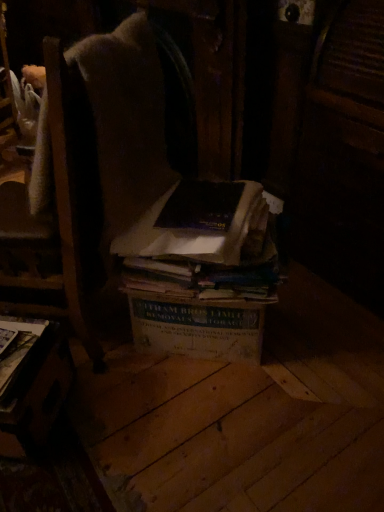
What do you see at coordinates (189, 234) in the screenshot? The width and height of the screenshot is (384, 512). I see `dark brown paper book at center, the second book when ordered from right to left` at bounding box center [189, 234].

Measure the distance between brown cardboard box at center, the 1th book viewed from the right, and camera.

brown cardboard box at center, the 1th book viewed from the right, is 1.16 meters away from camera.

The image size is (384, 512). I want to click on dark brown paper book at center, acting as the second book starting from the left, so click(189, 234).

Considering the sizes of dark brown paper book at center, the second book when ordered from right to left, and brown cardboard box at center, placed as the third book when sorted from left to right, in the image, is dark brown paper book at center, the second book when ordered from right to left, bigger or smaller than brown cardboard box at center, placed as the third book when sorted from left to right,?

dark brown paper book at center, the second book when ordered from right to left, is smaller than brown cardboard box at center, placed as the third book when sorted from left to right.

Is point (204, 241) positioned after point (166, 245)?

No.

This screenshot has height=512, width=384. What are the coordinates of `book that appears behind the dark brown paper book at center, acting as the second book starting from the left` in the screenshot? It's located at (201, 271).

In the scene shown: Is dark brown paper book at center, acting as the second book starting from the left, not close to brown cardboard box at center, placed as the third book when sorted from left to right?

No, dark brown paper book at center, acting as the second book starting from the left, is not far from brown cardboard box at center, placed as the third book when sorted from left to right.

Is dark brown paper book at center, the second book when ordered from right to left, to the left or to the right of wooden table at lower left in the image?

Clearly, dark brown paper book at center, the second book when ordered from right to left, is on the right of wooden table at lower left in the image.

From the image's perspective, which is above, dark brown paper book at center, acting as the second book starting from the left, or wooden table at lower left?

dark brown paper book at center, acting as the second book starting from the left, from the image's perspective.

Consider the image. Can you tell me how much dark brown paper book at center, acting as the second book starting from the left, and wooden table at lower left differ in facing direction?

dark brown paper book at center, acting as the second book starting from the left, and wooden table at lower left are facing 0.262 degrees away from each other.

From a real-world perspective, count 3rd books upward from the wooden table at lower left and point to it. Please provide its 2D coordinates.

[(189, 234)]

Measure the distance from brown cardboard box at center, the 1th book viewed from the right, to wooden table at lower left.

They are 17.97 inches apart.

Which is in front, brown cardboard box at center, the 1th book viewed from the right, or wooden table at lower left?

wooden table at lower left is in front.

Is brown cardboard box at center, the 1th book viewed from the right, completely or partially outside of wooden table at lower left?

Yes.

From the image's perspective, which one is positioned higher, brown cardboard box at center, the 1th book viewed from the right, or wooden table at lower left?

From the image's view, brown cardboard box at center, the 1th book viewed from the right, is above.

Considering the sizes of objects wooden table at lower left and hardcover book at lower left, the 1th book positioned from the left, in the image provided, who is thinner, wooden table at lower left or hardcover book at lower left, the 1th book positioned from the left,?

With smaller width is hardcover book at lower left, the 1th book positioned from the left.

Is wooden table at lower left in front of or behind hardcover book at lower left, the 1th book positioned from the left, in the image?

wooden table at lower left is positioned closer to the viewer than hardcover book at lower left, the 1th book positioned from the left.

You are a GUI agent. You are given a task and a screenshot of the screen. Output one action in this format:
    pyautogui.click(x=<x>, y=<y>)
    Task: Click on the book that is the 2nd object above the wooden table at lower left (from a real-world perspective)
    The image size is (384, 512).
    Given the screenshot: What is the action you would take?
    pyautogui.click(x=18, y=348)

Between wooden table at lower left and hardcover book at lower left, the third book in the right-to-left sequence, which one has more height?

Standing taller between the two is wooden table at lower left.

Is brown cardboard box at center, the 1th book viewed from the right, inside wooden table at lower left?

No, brown cardboard box at center, the 1th book viewed from the right, is not inside wooden table at lower left.

Is wooden table at lower left taller than brown cardboard box at center, the 1th book viewed from the right?

No.

Considering the sizes of objects wooden table at lower left and brown cardboard box at center, placed as the third book when sorted from left to right, in the image provided, who is bigger, wooden table at lower left or brown cardboard box at center, placed as the third book when sorted from left to right,?

brown cardboard box at center, placed as the third book when sorted from left to right.

Does point (40, 422) lie behind point (162, 273)?

That is False.

Which is nearer, (x=137, y=273) or (x=6, y=390)?

The point (x=6, y=390) is more forward.

Is hardcover book at lower left, the 1th book positioned from the left, a part of brown cardboard box at center, placed as the third book when sorted from left to right?

No, hardcover book at lower left, the 1th book positioned from the left, is located outside of brown cardboard box at center, placed as the third book when sorted from left to right.

Between brown cardboard box at center, placed as the third book when sorted from left to right, and hardcover book at lower left, the third book in the right-to-left sequence, which one has less height?

Standing shorter between the two is hardcover book at lower left, the third book in the right-to-left sequence.

Is the surface of brown cardboard box at center, placed as the third book when sorted from left to right, in direct contact with hardcover book at lower left, the third book in the right-to-left sequence?

brown cardboard box at center, placed as the third book when sorted from left to right, and hardcover book at lower left, the third book in the right-to-left sequence, are not in contact.

Which point is more forward, [38,336] or [67,382]?

Positioned in front is point [38,336].

Considering the sizes of objects hardcover book at lower left, the 1th book positioned from the left, and wooden table at lower left in the image provided, who is wider, hardcover book at lower left, the 1th book positioned from the left, or wooden table at lower left?

With larger width is wooden table at lower left.

Locate an element on the screen. the 1st book behind the wooden table at lower left is located at coordinates (18, 348).

Is hardcover book at lower left, the third book in the right-to-left sequence, outside of wooden table at lower left?

Actually, hardcover book at lower left, the third book in the right-to-left sequence, is at least partially inside wooden table at lower left.

The width and height of the screenshot is (384, 512). Identify the location of book located behind the dark brown paper book at center, the second book when ordered from right to left. (201, 271).

This screenshot has width=384, height=512. I want to click on table below the dark brown paper book at center, acting as the second book starting from the left (from a real-world perspective), so click(34, 387).

Considering their positions, is hardcover book at lower left, the third book in the right-to-left sequence, positioned further to wooden table at lower left than brown cardboard box at center, the 1th book viewed from the right?

brown cardboard box at center, the 1th book viewed from the right.

Based on their spatial positions, is hardcover book at lower left, the 1th book positioned from the left, or dark brown paper book at center, the second book when ordered from right to left, closer to wooden table at lower left?

Based on the image, hardcover book at lower left, the 1th book positioned from the left, appears to be nearer to wooden table at lower left.

Based on their spatial positions, is brown cardboard box at center, the 1th book viewed from the right, or dark brown paper book at center, acting as the second book starting from the left, closer to hardcover book at lower left, the third book in the right-to-left sequence?

Among the two, dark brown paper book at center, acting as the second book starting from the left, is located nearer to hardcover book at lower left, the third book in the right-to-left sequence.

From the image, which object appears to be nearer to dark brown paper book at center, the second book when ordered from right to left, hardcover book at lower left, the third book in the right-to-left sequence, or wooden table at lower left?

wooden table at lower left lies closer to dark brown paper book at center, the second book when ordered from right to left, than the other object.

Considering their positions, is hardcover book at lower left, the third book in the right-to-left sequence, positioned closer to brown cardboard box at center, placed as the third book when sorted from left to right, than dark brown paper book at center, the second book when ordered from right to left?

dark brown paper book at center, the second book when ordered from right to left.

Considering their positions, is wooden table at lower left positioned further to hardcover book at lower left, the 1th book positioned from the left, than brown cardboard box at center, placed as the third book when sorted from left to right?

Based on the image, brown cardboard box at center, placed as the third book when sorted from left to right, appears to be further to hardcover book at lower left, the 1th book positioned from the left.

Consider the image. Based on their spatial positions, is dark brown paper book at center, acting as the second book starting from the left, or wooden table at lower left closer to hardcover book at lower left, the third book in the right-to-left sequence?

Based on the image, wooden table at lower left appears to be nearer to hardcover book at lower left, the third book in the right-to-left sequence.

When comparing their distances from wooden table at lower left, does dark brown paper book at center, the second book when ordered from right to left, or hardcover book at lower left, the third book in the right-to-left sequence, seem further?

dark brown paper book at center, the second book when ordered from right to left, lies further to wooden table at lower left than the other object.

In order to click on table situated between hardcover book at lower left, the third book in the right-to-left sequence, and dark brown paper book at center, acting as the second book starting from the left, from left to right in this screenshot , I will do `click(34, 387)`.

This screenshot has width=384, height=512. I want to click on table located between hardcover book at lower left, the third book in the right-to-left sequence, and brown cardboard box at center, the 1th book viewed from the right, in the left-right direction, so click(x=34, y=387).

Where is `book situated between wooden table at lower left and brown cardboard box at center, the 1th book viewed from the right, from left to right`? book situated between wooden table at lower left and brown cardboard box at center, the 1th book viewed from the right, from left to right is located at coordinates (189, 234).

This screenshot has height=512, width=384. I want to click on book located between hardcover book at lower left, the third book in the right-to-left sequence, and brown cardboard box at center, the 1th book viewed from the right, in the left-right direction, so click(x=189, y=234).